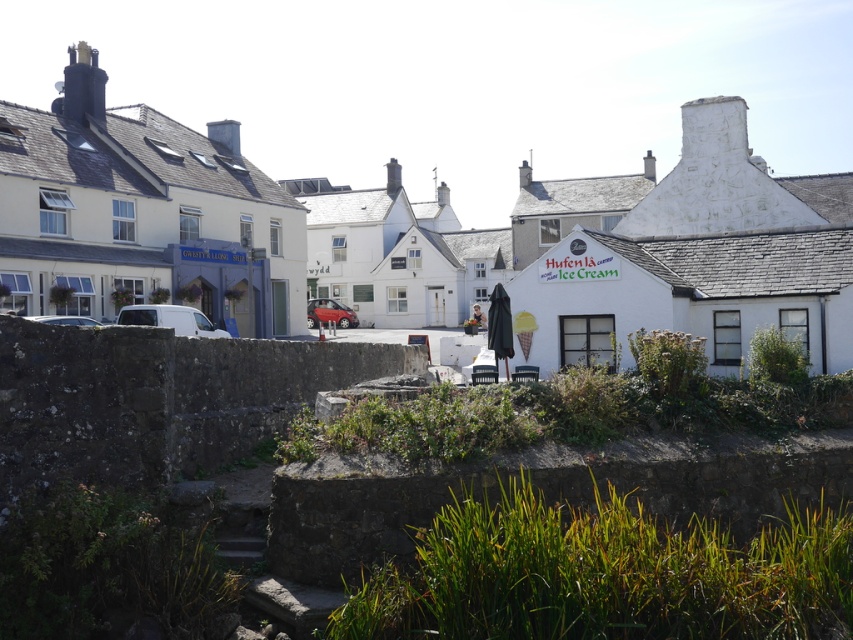
Which is below, white matte ice cream shop at center or white matte van at center?

white matte van at center is below.

Between white matte ice cream shop at center and white matte van at center, which one has less height?

Standing shorter between the two is white matte van at center.

The width and height of the screenshot is (853, 640). Find the location of `white matte ice cream shop at center`. white matte ice cream shop at center is located at coordinates (426, 236).

Is point (221, 336) farther from viewer compared to point (308, 300)?

No, it is not.

Does white matte van at left have a greater width compared to shiny red car at center?

No.

Who is more distant from viewer, (x=149, y=307) or (x=355, y=323)?

Positioned behind is point (x=355, y=323).

Where is `white matte van at left`? white matte van at left is located at coordinates (170, 320).

Is shiny red car at center to the left of white matte van at center from the viewer's perspective?

No, shiny red car at center is not to the left of white matte van at center.

Image resolution: width=853 pixels, height=640 pixels. What do you see at coordinates (329, 314) in the screenshot?
I see `shiny red car at center` at bounding box center [329, 314].

Identify the location of shiny red car at center. (329, 314).

Locate an element on the screen. This screenshot has width=853, height=640. shiny red car at center is located at coordinates (329, 314).